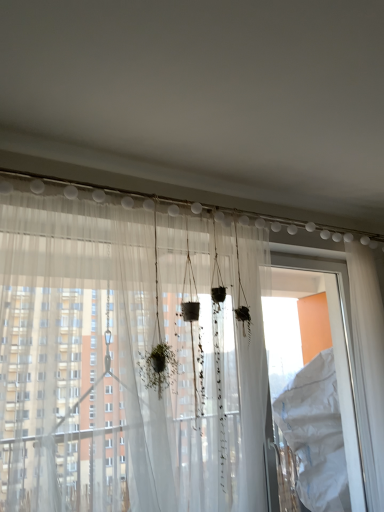
The width and height of the screenshot is (384, 512). I want to click on translucent fabric at center, so click(x=77, y=413).

The height and width of the screenshot is (512, 384). Describe the element at coordinates (169, 361) in the screenshot. I see `translucent fabric curtain at center` at that location.

Find the location of `translucent fabric at center`. translucent fabric at center is located at coordinates (77, 413).

From the image's perspective, would you say white plastic screen door at right is shown under translucent fabric at center?

Yes, from the image's perspective, white plastic screen door at right is below translucent fabric at center.

Considering the relative sizes of white plastic screen door at right and translucent fabric at center in the image provided, is white plastic screen door at right smaller than translucent fabric at center?

Indeed, white plastic screen door at right has a smaller size compared to translucent fabric at center.

Considering the sizes of objects white plastic screen door at right and translucent fabric at center in the image provided, who is taller, white plastic screen door at right or translucent fabric at center?

white plastic screen door at right is taller.

Looking at their sizes, would you say white plastic screen door at right is wider or thinner than translucent fabric at center?

In the image, white plastic screen door at right appears to be more narrow than translucent fabric at center.

Between translucent fabric at center and translucent fabric curtain at center, which one has smaller size?

translucent fabric at center.

Considering the sizes of translucent fabric at center and translucent fabric curtain at center in the image, is translucent fabric at center taller or shorter than translucent fabric curtain at center?

Considering their sizes, translucent fabric at center has less height than translucent fabric curtain at center.

Based on the photo, is translucent fabric at center far away from translucent fabric curtain at center?

No, translucent fabric at center is in close proximity to translucent fabric curtain at center.

Is translucent fabric at center not within translucent fabric curtain at center?

No, translucent fabric at center is inside or overlapping with translucent fabric curtain at center.

Is white plastic screen door at right in front of or behind translucent fabric curtain at center in the image?

In the image, white plastic screen door at right appears behind translucent fabric curtain at center.

Image resolution: width=384 pixels, height=512 pixels. Find the location of `screen door below the translucent fabric curtain at center (from the image's perspective)`. screen door below the translucent fabric curtain at center (from the image's perspective) is located at coordinates (313, 388).

Are white plastic screen door at right and translucent fabric curtain at center beside each other?

No, white plastic screen door at right is not beside translucent fabric curtain at center.

Considering the sizes of white plastic screen door at right and translucent fabric curtain at center in the image, is white plastic screen door at right bigger or smaller than translucent fabric curtain at center?

In the image, white plastic screen door at right appears to be smaller than translucent fabric curtain at center.

Is translucent fabric at center next to white plastic screen door at right?

They are not placed beside each other.

Is translucent fabric at center taller than white plastic screen door at right?

No, translucent fabric at center is not taller than white plastic screen door at right.

In the image, is translucent fabric at center on the left side or the right side of white plastic screen door at right?

In the image, translucent fabric at center appears on the left side of white plastic screen door at right.

Is translucent fabric at center turned away from white plastic screen door at right?

No.

How much distance is there between translucent fabric curtain at center and translucent fabric at center?

translucent fabric curtain at center and translucent fabric at center are 4.92 inches apart from each other.

In the scene shown: Is translucent fabric curtain at center facing towards translucent fabric at center?

Yes, translucent fabric curtain at center is turned towards translucent fabric at center.

Is translucent fabric curtain at center next to translucent fabric at center?

There is a gap between translucent fabric curtain at center and translucent fabric at center.

Which of these two, translucent fabric curtain at center or translucent fabric at center, is wider?

translucent fabric curtain at center is wider.

Which is behind, translucent fabric curtain at center or white plastic screen door at right?

white plastic screen door at right is behind.

In the scene shown: How many degrees apart are the facing directions of translucent fabric curtain at center and white plastic screen door at right?

The angle between the facing direction of translucent fabric curtain at center and the facing direction of white plastic screen door at right is 2.3 degrees.

Between translucent fabric curtain at center and white plastic screen door at right, which one has less height?

Standing shorter between the two is translucent fabric curtain at center.

From a real-world perspective, which is physically above, translucent fabric curtain at center or white plastic screen door at right?

white plastic screen door at right, from a real-world perspective.

Locate an element on the screen. This screenshot has height=512, width=384. window lying in front of the white plastic screen door at right is located at coordinates (77, 413).

Locate an element on the screen. window positioned vertically above the translucent fabric curtain at center (from a real-world perspective) is located at coordinates (77, 413).

When comparing their distances from translucent fabric curtain at center, does white plastic screen door at right or translucent fabric at center seem closer?

translucent fabric at center lies closer to translucent fabric curtain at center than the other object.

Looking at the image, which one is located closer to white plastic screen door at right, translucent fabric curtain at center or translucent fabric at center?

translucent fabric curtain at center is closer to white plastic screen door at right.

When comparing their distances from translucent fabric curtain at center, does translucent fabric at center or white plastic screen door at right seem closer?

The object closer to translucent fabric curtain at center is translucent fabric at center.

Based on their spatial positions, is translucent fabric at center or translucent fabric curtain at center further from white plastic screen door at right?

Based on the image, translucent fabric at center appears to be further to white plastic screen door at right.

Looking at the image, which one is located closer to translucent fabric at center, translucent fabric curtain at center or white plastic screen door at right?

Based on the image, translucent fabric curtain at center appears to be nearer to translucent fabric at center.

When comparing their distances from translucent fabric at center, does white plastic screen door at right or translucent fabric curtain at center seem further?

white plastic screen door at right.

This screenshot has height=512, width=384. In order to click on curtain between translucent fabric at center and white plastic screen door at right in this screenshot , I will do `click(169, 361)`.